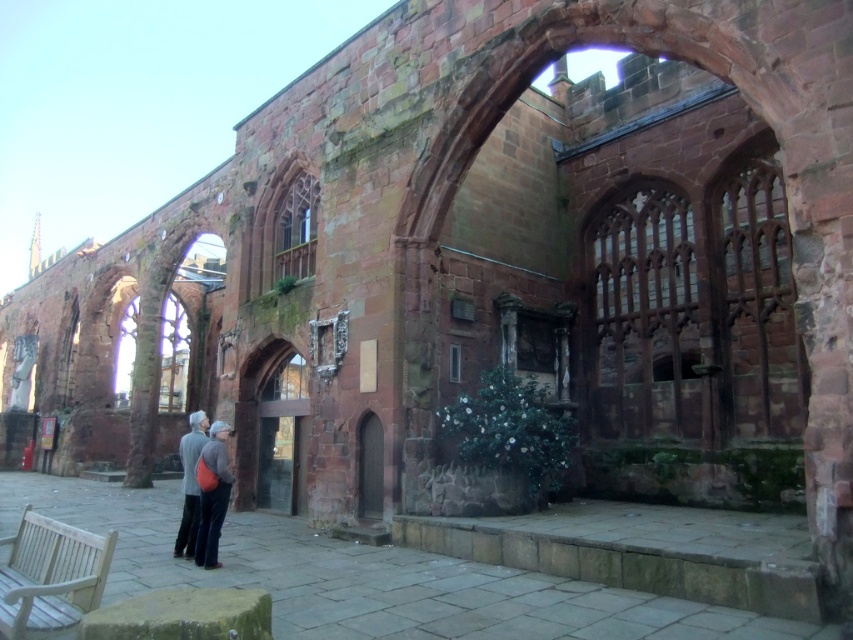
Based on the photo, you are a tourist visiting this historical site and want to place your matte orange backpack at lower left on the white wooden bench at lower left. Can the backpack fit on the bench?

The white wooden bench at lower left is wider than the matte orange backpack at lower left, so yes, the backpack can fit on the bench.

You are standing at the entrance of the ancient stone structure and want to reach the wooden bench partially visible on the left side. There are two points marked on your map as point A at coordinates point A is point (1, 596) and point B at coordinates point B is point (207, 550). Which point is closer to the wooden bench?

Point A at coordinates point (1, 596) is closer to the wooden bench because it is in front of point B at coordinates point (207, 550).